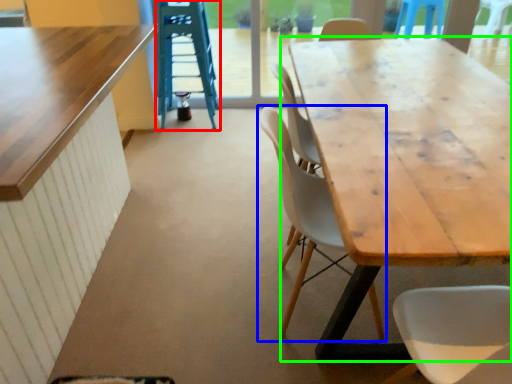
Question: Which object is the closest to the ladder (highlighted by a red box)? Choose among these: chair (highlighted by a blue box) or table (highlighted by a green box).

Choices:
 (A) chair
 (B) table

Answer: (B)